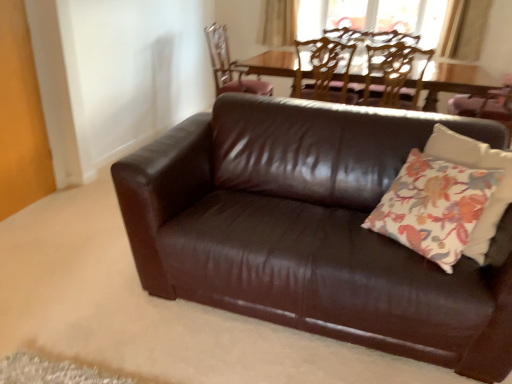
Find the location of a particular element. The height and width of the screenshot is (384, 512). wooden chair at upper center, the 3th chair from the right is located at coordinates (230, 66).

Identify the location of floral fabric pillow at center. (434, 207).

This screenshot has width=512, height=384. Describe the element at coordinates (394, 75) in the screenshot. I see `wooden textured chair at upper center, the 3th chair viewed from the left` at that location.

Identify the location of wooden textured chair at upper center, the 1th chair when ordered from right to left. (394, 75).

Measure the distance between brown leather couch at center and camera.

1.40 meters.

Identify the location of wooden chair at upper center, the 3th chair from the right. (230, 66).

Is beige fabric curtain at upper center directly adjacent to wooden textured chair at upper center, the 3th chair viewed from the left?

No, beige fabric curtain at upper center is not touching wooden textured chair at upper center, the 3th chair viewed from the left.

Is beige fabric curtain at upper center taller than wooden textured chair at upper center, the 1th chair when ordered from right to left?

Incorrect, the height of beige fabric curtain at upper center is not larger of that of wooden textured chair at upper center, the 1th chair when ordered from right to left.

Which is in front, point (280, 31) or point (384, 78)?

The point (384, 78) is in front.

Locate an element on the screen. The width and height of the screenshot is (512, 384). curtain above the wooden textured chair at upper center, the 3th chair viewed from the left (from a real-world perspective) is located at coordinates (278, 23).

Image resolution: width=512 pixels, height=384 pixels. I want to click on chair lying behind the brown leather chair at upper center, the 2th chair viewed from the right, so click(230, 66).

Could you tell me if brown leather chair at upper center, the 2th chair viewed from the right, is facing wooden chair at upper center, the 3th chair from the right?

No, brown leather chair at upper center, the 2th chair viewed from the right, is not aimed at wooden chair at upper center, the 3th chair from the right.

Who is taller, brown leather chair at upper center, marked as the second chair in a left-to-right arrangement, or wooden chair at upper center, positioned as the 1th chair in left-to-right order?

wooden chair at upper center, positioned as the 1th chair in left-to-right order, is taller.

Is brown leather chair at upper center, the 2th chair viewed from the right, at the right side of wooden chair at upper center, the 3th chair from the right?

Indeed, brown leather chair at upper center, the 2th chair viewed from the right, is positioned on the right side of wooden chair at upper center, the 3th chair from the right.

Is brown leather chair at upper center, marked as the second chair in a left-to-right arrangement, to the right of beige fabric curtain at upper center from the viewer's perspective?

Indeed, brown leather chair at upper center, marked as the second chair in a left-to-right arrangement, is positioned on the right side of beige fabric curtain at upper center.

From their relative heights in the image, would you say brown leather chair at upper center, the 2th chair viewed from the right, is taller or shorter than beige fabric curtain at upper center?

Clearly, brown leather chair at upper center, the 2th chair viewed from the right, is taller compared to beige fabric curtain at upper center.

Does brown leather chair at upper center, marked as the second chair in a left-to-right arrangement, have a smaller size compared to beige fabric curtain at upper center?

Incorrect, brown leather chair at upper center, marked as the second chair in a left-to-right arrangement, is not smaller in size than beige fabric curtain at upper center.

At what (x,y) coordinates should I click in order to perform the action: click on chair located on the left of brown leather chair at upper center, marked as the second chair in a left-to-right arrangement. Please return your answer as a coordinate pair (x, y). The image size is (512, 384). Looking at the image, I should click on (230, 66).

From the image's perspective, which object appears higher, wooden chair at upper center, positioned as the 1th chair in left-to-right order, or brown leather chair at upper center, the 2th chair viewed from the right?

wooden chair at upper center, positioned as the 1th chair in left-to-right order, from the image's perspective.

Is point (229, 75) behind point (309, 77)?

Yes, it is behind point (309, 77).

Can you confirm if wooden chair at upper center, positioned as the 1th chair in left-to-right order, is shorter than brown leather chair at upper center, marked as the second chair in a left-to-right arrangement?

In fact, wooden chair at upper center, positioned as the 1th chair in left-to-right order, may be taller than brown leather chair at upper center, marked as the second chair in a left-to-right arrangement.

Considering the relative sizes of brown leather chair at upper center, marked as the second chair in a left-to-right arrangement, and floral fabric pillow at center in the image provided, is brown leather chair at upper center, marked as the second chair in a left-to-right arrangement, bigger than floral fabric pillow at center?

Indeed, brown leather chair at upper center, marked as the second chair in a left-to-right arrangement, has a larger size compared to floral fabric pillow at center.

Could you measure the distance between brown leather chair at upper center, marked as the second chair in a left-to-right arrangement, and floral fabric pillow at center?

6.14 feet.

Does brown leather chair at upper center, the 2th chair viewed from the right, turn towards floral fabric pillow at center?

No, brown leather chair at upper center, the 2th chair viewed from the right, is not turned towards floral fabric pillow at center.

Between brown leather couch at center and wooden textured chair at upper center, the 1th chair when ordered from right to left, which one has smaller width?

Thinner between the two is wooden textured chair at upper center, the 1th chair when ordered from right to left.

Considering the positions of point (380, 151) and point (366, 85), is point (380, 151) closer or farther from the camera than point (366, 85)?

Point (380, 151) is positioned closer to the camera compared to point (366, 85).

Which is more to the left, brown leather couch at center or wooden textured chair at upper center, the 1th chair when ordered from right to left?

brown leather couch at center is more to the left.

From the image's perspective, is brown leather couch at center located above wooden textured chair at upper center, the 1th chair when ordered from right to left?

No, from the image's perspective, brown leather couch at center is not on top of wooden textured chair at upper center, the 1th chair when ordered from right to left.

In the scene shown: Can you see wooden chair at upper center, the 3th chair from the right, touching wooden textured chair at upper center, the 3th chair viewed from the left?

No, wooden chair at upper center, the 3th chair from the right, is not next to wooden textured chair at upper center, the 3th chair viewed from the left.

Is wooden chair at upper center, positioned as the 1th chair in left-to-right order, inside or outside of wooden textured chair at upper center, the 3th chair viewed from the left?

wooden chair at upper center, positioned as the 1th chair in left-to-right order, lies outside wooden textured chair at upper center, the 3th chair viewed from the left.

Is wooden chair at upper center, the 3th chair from the right, bigger or smaller than wooden textured chair at upper center, the 3th chair viewed from the left?

In the image, wooden chair at upper center, the 3th chair from the right, appears to be larger than wooden textured chair at upper center, the 3th chair viewed from the left.

The image size is (512, 384). I want to click on curtain located behind the wooden textured chair at upper center, the 3th chair viewed from the left, so click(278, 23).

From a real-world perspective, starting from the wooden chair at upper center, the 3th chair from the right, which chair is the 2nd one vertically above it? Please provide its 2D coordinates.

[(323, 70)]

Based on their spatial positions, is wooden chair at upper center, the 3th chair from the right, or brown leather chair at upper center, marked as the second chair in a left-to-right arrangement, closer to brown leather couch at center?

brown leather chair at upper center, marked as the second chair in a left-to-right arrangement, lies closer to brown leather couch at center than the other object.

Which object lies further to the anchor point brown leather chair at upper center, the 2th chair viewed from the right, wooden textured chair at upper center, the 3th chair viewed from the left, or beige fabric curtain at upper center?

beige fabric curtain at upper center is further to brown leather chair at upper center, the 2th chair viewed from the right.

Looking at the image, which one is located further to brown leather chair at upper center, marked as the second chair in a left-to-right arrangement, floral fabric pillow at center or wooden chair at upper center, positioned as the 1th chair in left-to-right order?

floral fabric pillow at center is positioned further to the anchor brown leather chair at upper center, marked as the second chair in a left-to-right arrangement.

Estimate the real-world distances between objects in this image. Which object is closer to brown leather couch at center, beige fabric curtain at upper center or floral fabric pillow at center?

floral fabric pillow at center is closer to brown leather couch at center.

From the image, which object appears to be nearer to floral fabric pillow at center, brown leather couch at center or wooden chair at upper center, positioned as the 1th chair in left-to-right order?

Based on the image, brown leather couch at center appears to be nearer to floral fabric pillow at center.

Which object lies further to the anchor point floral fabric pillow at center, brown leather chair at upper center, the 2th chair viewed from the right, or beige fabric curtain at upper center?

Among the two, beige fabric curtain at upper center is located further to floral fabric pillow at center.

Looking at the image, which one is located closer to brown leather chair at upper center, marked as the second chair in a left-to-right arrangement, wooden textured chair at upper center, the 3th chair viewed from the left, or brown leather couch at center?

wooden textured chair at upper center, the 3th chair viewed from the left, is closer to brown leather chair at upper center, marked as the second chair in a left-to-right arrangement.

Based on their spatial positions, is brown leather couch at center or wooden chair at upper center, positioned as the 1th chair in left-to-right order, further from beige fabric curtain at upper center?

brown leather couch at center is further to beige fabric curtain at upper center.

The image size is (512, 384). In order to click on chair between brown leather chair at upper center, the 2th chair viewed from the right, and beige fabric curtain at upper center, along the z-axis in this screenshot , I will do `click(230, 66)`.

Where is `chair between wooden chair at upper center, positioned as the 1th chair in left-to-right order, and wooden textured chair at upper center, the 1th chair when ordered from right to left, from left to right`? The width and height of the screenshot is (512, 384). chair between wooden chair at upper center, positioned as the 1th chair in left-to-right order, and wooden textured chair at upper center, the 1th chair when ordered from right to left, from left to right is located at coordinates (x=323, y=70).

In order to click on throw pillow between brown leather couch at center and brown leather chair at upper center, marked as the second chair in a left-to-right arrangement, in the front-back direction in this screenshot , I will do `click(434, 207)`.

The width and height of the screenshot is (512, 384). Identify the location of throw pillow between brown leather couch at center and wooden chair at upper center, positioned as the 1th chair in left-to-right order, in the front-back direction. point(434,207).